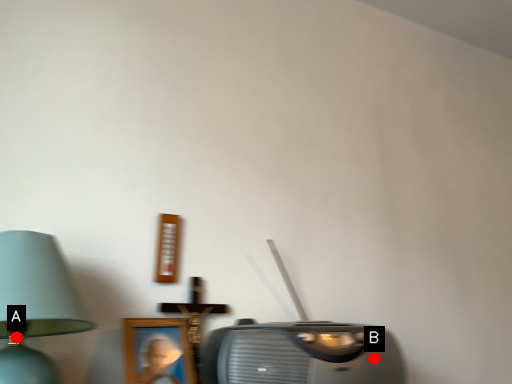
Question: Two points are circled on the image, labeled by A and B beside each circle. Which point is farther to the camera?

Choices:
 (A) A is further
 (B) B is further

Answer: (B)